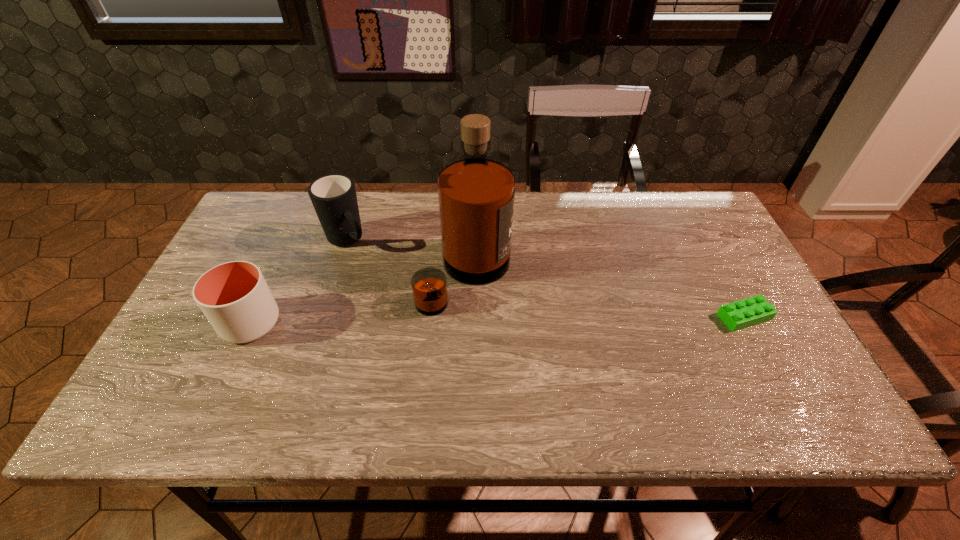
Locate an element on the screen. Image resolution: width=960 pixels, height=540 pixels. vacant space positioned 0.250m on the side of the second object from left to right with the handle is located at coordinates 410,303.

In order to click on free space located 0.290m on the side of the second object from left to right with the handle in this screenshot , I will do `click(419, 313)`.

You are a GUI agent. You are given a task and a screenshot of the screen. Output one action in this format:
    pyautogui.click(x=<x>, y=<y>)
    Task: Click on the vacant region located on the side of the second object from left to right with the handle
    The width and height of the screenshot is (960, 540).
    Given the screenshot: What is the action you would take?
    pyautogui.click(x=423, y=318)

I want to click on free space located 0.070m on the front label of the liquor, so click(530, 306).

Identify the location of free space located on the front label of the liquor. The height and width of the screenshot is (540, 960). pyautogui.click(x=578, y=326).

Locate an element on the screen. The image size is (960, 540). free space located on the front label of the liquor is located at coordinates (622, 345).

The height and width of the screenshot is (540, 960). What are the coordinates of `mug positioned at the far edge` in the screenshot? It's located at (334, 198).

At what (x,y) coordinates should I click in order to perform the action: click on liquor located at the far edge. Please return your answer as a coordinate pair (x, y). Looking at the image, I should click on (476, 194).

At what (x,y) coordinates should I click in order to perform the action: click on object present at the left edge. Please return your answer as a coordinate pair (x, y). This screenshot has width=960, height=540. Looking at the image, I should click on (234, 296).

Locate an element on the screen. This screenshot has height=540, width=960. object positioned at the right edge is located at coordinates (751, 311).